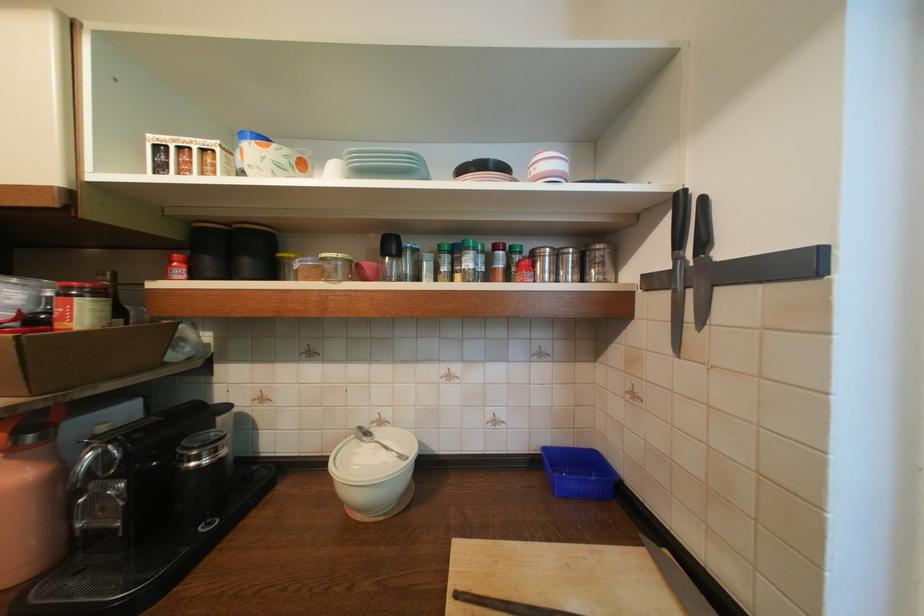
I want to click on red-capped spice jar, so click(176, 267).